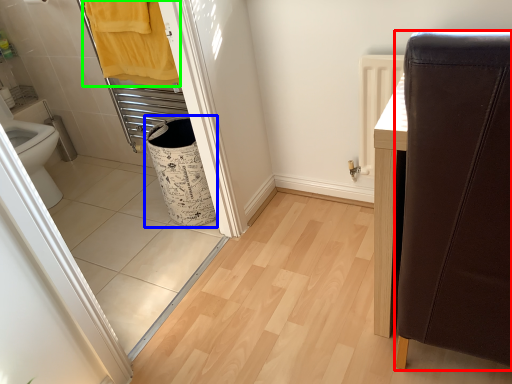
Question: Which object is the closest to the furniture (highlighted by a red box)? Choose among these: laundry basket (highlighted by a blue box) or bath towel (highlighted by a green box).

Choices:
 (A) laundry basket
 (B) bath towel

Answer: (A)